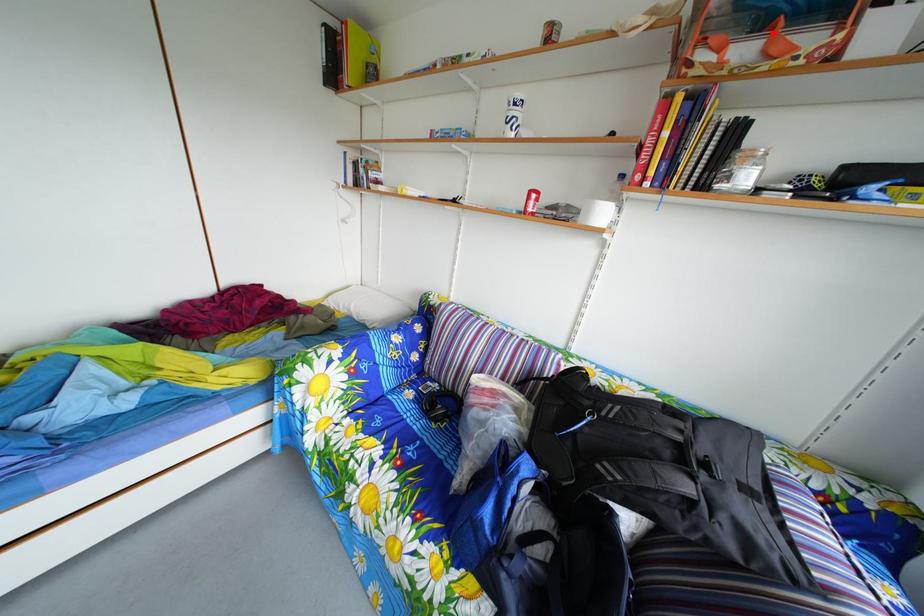
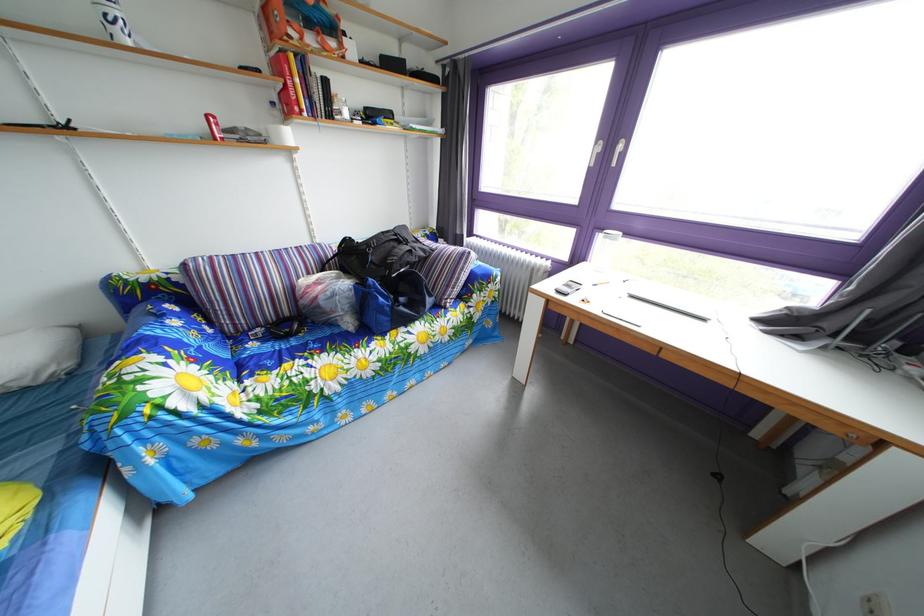
Where in the second image is the point corresponding to the highlighted location from the first image?

(320, 33)